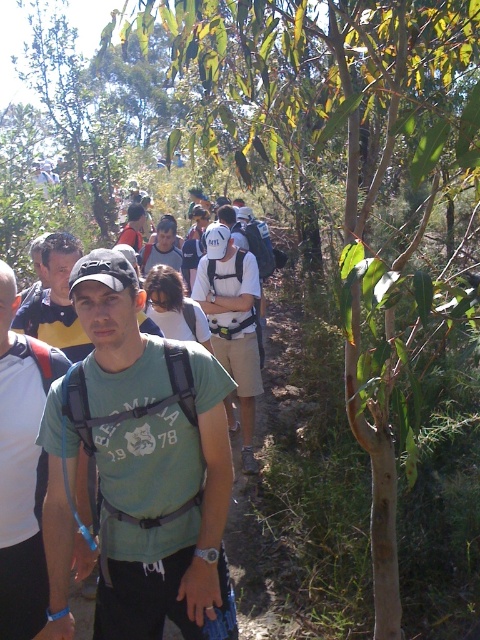
Question: Which of the following is the closest to the observer?

Choices:
 (A) green matte t-shirt at center
 (B) matte gray shirt at center
 (C) white matte backpack at center

Answer: (A)

Question: Among these objects, which one is nearest to the camera?

Choices:
 (A) green matte t-shirt at center
 (B) matte black backpack at center

Answer: (A)

Question: Is green matte t-shirt at center to the right of green fabric shirt at center from the viewer's perspective?

Choices:
 (A) no
 (B) yes

Answer: (B)

Question: Considering the relative positions of green fabric shirt at center and matte black backpack at center in the image provided, where is green fabric shirt at center located with respect to matte black backpack at center?

Choices:
 (A) below
 (B) above

Answer: (A)

Question: Can you confirm if green matte t-shirt at center is positioned above matte black backpack at center?

Choices:
 (A) yes
 (B) no

Answer: (B)

Question: Which object appears farthest from the camera in this image?

Choices:
 (A) matte black backpack at center
 (B) white matte backpack at center
 (C) green fabric shirt at center

Answer: (A)